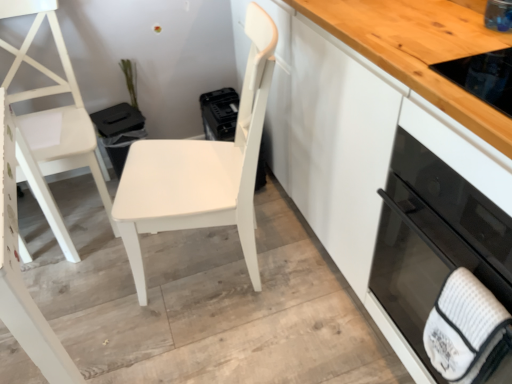
Describe the element at coordinates (466, 330) in the screenshot. I see `white textured hand towel at lower right` at that location.

What is the approximate width of white matte chair at left, which is the 2th chair in right-to-left order?

white matte chair at left, which is the 2th chair in right-to-left order, is 22.09 inches in width.

Describe the element at coordinates (51, 124) in the screenshot. I see `white matte chair at left, positioned as the 1th chair in left-to-right order` at that location.

Identify the location of white glossy cabinet at center. The height and width of the screenshot is (384, 512). (385, 181).

At what (x,y) coordinates should I click in order to perform the action: click on white matte chair at center, the second chair from the left. Please return your answer as a coordinate pair (x, y). The width and height of the screenshot is (512, 384). Looking at the image, I should click on (201, 170).

From the image's perspective, which is above, black glass oven at right or white matte chair at left, positioned as the 1th chair in left-to-right order?

white matte chair at left, positioned as the 1th chair in left-to-right order, is shown above in the image.

Does black glass oven at right appear on the right side of white matte chair at left, positioned as the 1th chair in left-to-right order?

Correct, you'll find black glass oven at right to the right of white matte chair at left, positioned as the 1th chair in left-to-right order.

From a real-world perspective, count 2nd chairs downward from the black glass oven at right and point to it. Please provide its 2D coordinates.

[(51, 124)]

Who is shorter, white matte chair at left, positioned as the 1th chair in left-to-right order, or black glass oven at right?

black glass oven at right.

Does white matte chair at left, which is the 2th chair in right-to-left order, have a larger size compared to black glass oven at right?

Indeed, white matte chair at left, which is the 2th chair in right-to-left order, has a larger size compared to black glass oven at right.

Is white matte chair at left, positioned as the 1th chair in left-to-right order, outside of black glass oven at right?

white matte chair at left, positioned as the 1th chair in left-to-right order, lies outside black glass oven at right's area.

From the image's perspective, is white matte chair at left, which is the 2th chair in right-to-left order, located above or below black glass oven at right?

From the image's perspective, white matte chair at left, which is the 2th chair in right-to-left order, appears above black glass oven at right.

Are black glass oven at right and white glossy cabinet at center far apart?

No, there isn't a large distance between black glass oven at right and white glossy cabinet at center.

Is black glass oven at right aimed at white glossy cabinet at center?

Yes, black glass oven at right is facing white glossy cabinet at center.

From the image's perspective, is black glass oven at right positioned above or below white glossy cabinet at center?

From the image's perspective, black glass oven at right appears below white glossy cabinet at center.

Based on the photo, what's the angular difference between black glass oven at right and white glossy cabinet at center's facing directions?

black glass oven at right and white glossy cabinet at center are facing 0.000293 degrees away from each other.

Considering the positions of objects white matte chair at left, which is the 2th chair in right-to-left order, and white matte chair at center, which ranks as the 1th chair in right-to-left order, in the image provided, who is more to the right, white matte chair at left, which is the 2th chair in right-to-left order, or white matte chair at center, which ranks as the 1th chair in right-to-left order,?

white matte chair at center, which ranks as the 1th chair in right-to-left order, is more to the right.

Where is `chair that appears on the right of white matte chair at left, positioned as the 1th chair in left-to-right order`? The image size is (512, 384). chair that appears on the right of white matte chair at left, positioned as the 1th chair in left-to-right order is located at coordinates (201, 170).

Are white matte chair at left, positioned as the 1th chair in left-to-right order, and white matte chair at center, the second chair from the left, located far from each other?

No, white matte chair at left, positioned as the 1th chair in left-to-right order, is not far from white matte chair at center, the second chair from the left.

Would you say white matte chair at center, which ranks as the 1th chair in right-to-left order, is part of white matte chair at left, which is the 2th chair in right-to-left order,'s contents?

No, white matte chair at left, which is the 2th chair in right-to-left order, does not contain white matte chair at center, which ranks as the 1th chair in right-to-left order.

From the image's perspective, which one is positioned higher, white textured hand towel at lower right or white glossy cabinet at center?

white glossy cabinet at center, from the image's perspective.

Considering the relative sizes of white textured hand towel at lower right and white glossy cabinet at center in the image provided, is white textured hand towel at lower right taller than white glossy cabinet at center?

No, white textured hand towel at lower right is not taller than white glossy cabinet at center.

Is point (451, 320) positioned before point (311, 218)?

Yes, point (451, 320) is closer to viewer.

Where is `chair below the white matte chair at left, which is the 2th chair in right-to-left order (from the image's perspective)`? The height and width of the screenshot is (384, 512). chair below the white matte chair at left, which is the 2th chair in right-to-left order (from the image's perspective) is located at coordinates (201, 170).

Would you say white matte chair at center, the second chair from the left, is inside or outside white matte chair at left, positioned as the 1th chair in left-to-right order?

white matte chair at center, the second chair from the left, is not enclosed by white matte chair at left, positioned as the 1th chair in left-to-right order.

How many degrees apart are the facing directions of white matte chair at center, the second chair from the left, and white matte chair at left, which is the 2th chair in right-to-left order?

106 degrees.

From the image's perspective, is white glossy cabinet at center above white matte chair at left, which is the 2th chair in right-to-left order?

Correct, white glossy cabinet at center appears higher than white matte chair at left, which is the 2th chair in right-to-left order, in the image.

From a real-world perspective, which is physically below, white glossy cabinet at center or white matte chair at left, positioned as the 1th chair in left-to-right order?

white matte chair at left, positioned as the 1th chair in left-to-right order, is physically lower.

Does point (459, 174) lie behind point (20, 168)?

No, (459, 174) is in front of (20, 168).

Would you say white glossy cabinet at center contains white matte chair at left, which is the 2th chair in right-to-left order?

No.

Identify the location of chair that is the 2nd object located above the black glass oven at right (from the image's perspective). This screenshot has width=512, height=384. (51, 124).

Locate an element on the screen. home appliance on the right of white matte chair at left, positioned as the 1th chair in left-to-right order is located at coordinates (434, 239).

Looking at the image, which one is located further to white matte chair at left, positioned as the 1th chair in left-to-right order, white textured hand towel at lower right or black glass oven at right?

white textured hand towel at lower right is further to white matte chair at left, positioned as the 1th chair in left-to-right order.

Looking at the image, which one is located closer to white textured hand towel at lower right, black glass oven at right or white matte chair at center, which ranks as the 1th chair in right-to-left order?

black glass oven at right is closer to white textured hand towel at lower right.

Based on their spatial positions, is white textured hand towel at lower right or white matte chair at center, the second chair from the left, further from white matte chair at left, positioned as the 1th chair in left-to-right order?

white textured hand towel at lower right lies further to white matte chair at left, positioned as the 1th chair in left-to-right order, than the other object.

Looking at the image, which one is located closer to white matte chair at left, which is the 2th chair in right-to-left order, white matte chair at center, which ranks as the 1th chair in right-to-left order, or black glass oven at right?

Based on the image, white matte chair at center, which ranks as the 1th chair in right-to-left order, appears to be nearer to white matte chair at left, which is the 2th chair in right-to-left order.

Looking at the image, which one is located closer to white glossy cabinet at center, black glass oven at right or white matte chair at left, which is the 2th chair in right-to-left order?

Among the two, black glass oven at right is located nearer to white glossy cabinet at center.

Estimate the real-world distances between objects in this image. Which object is further from white matte chair at left, which is the 2th chair in right-to-left order, white textured hand towel at lower right or white glossy cabinet at center?

white textured hand towel at lower right is further to white matte chair at left, which is the 2th chair in right-to-left order.

When comparing their distances from white textured hand towel at lower right, does white matte chair at left, which is the 2th chair in right-to-left order, or white glossy cabinet at center seem further?

white matte chair at left, which is the 2th chair in right-to-left order, lies further to white textured hand towel at lower right than the other object.

Which object lies further to the anchor point black glass oven at right, white matte chair at center, the second chair from the left, or white matte chair at left, which is the 2th chair in right-to-left order?

white matte chair at left, which is the 2th chair in right-to-left order, is further to black glass oven at right.

Identify the location of cabinetry between white matte chair at left, which is the 2th chair in right-to-left order, and black glass oven at right, in the horizontal direction. The width and height of the screenshot is (512, 384). (385, 181).

Find the location of a particular element. The width and height of the screenshot is (512, 384). hand towel situated between white matte chair at left, which is the 2th chair in right-to-left order, and white glossy cabinet at center from left to right is located at coordinates (466, 330).

In order to click on chair between white matte chair at left, which is the 2th chair in right-to-left order, and white textured hand towel at lower right in this screenshot , I will do `click(201, 170)`.

Find the location of a particular element. The image size is (512, 384). hand towel between white matte chair at center, the second chair from the left, and black glass oven at right is located at coordinates (466, 330).